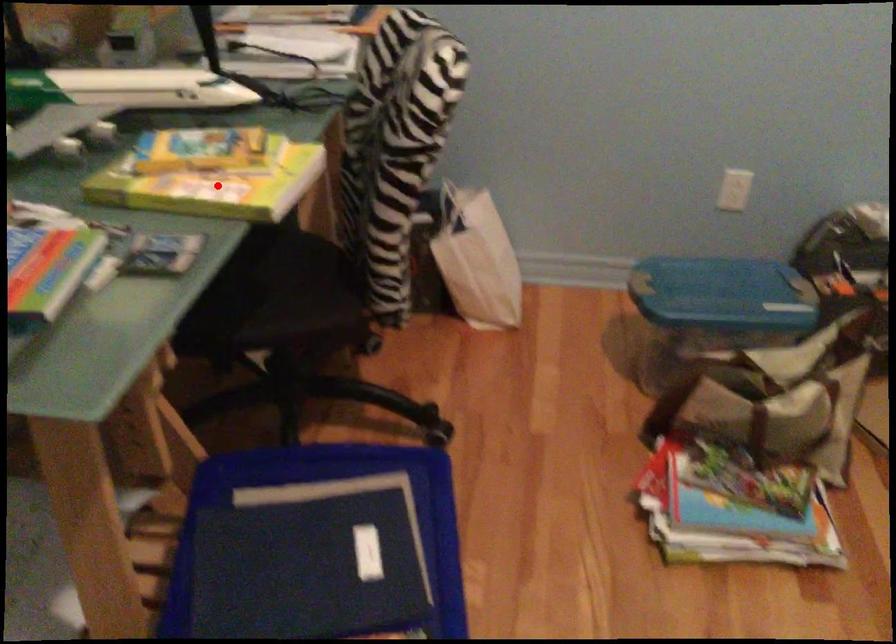
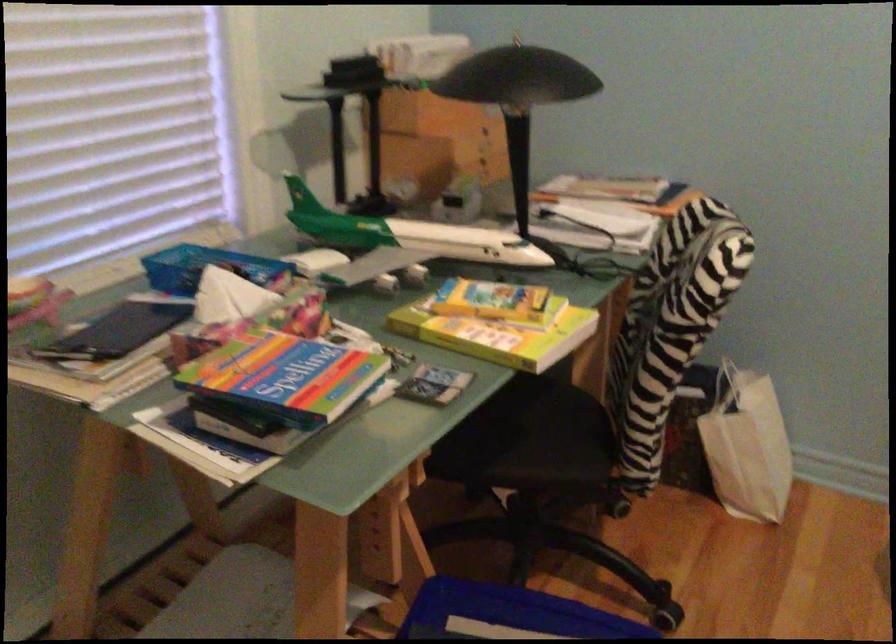
Question: I am providing you with two images of the same scene from different viewpoints. In image1, a red point is highlighted. Considering the same 3D point in image2, which of the following is correct?

Choices:
 (A) It is closer
 (B) It is farther

Answer: (B)